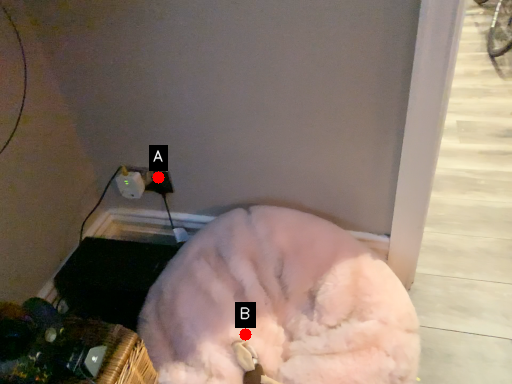
Question: Two points are circled on the image, labeled by A and B beside each circle. Which point appears closest to the camera in this image?

Choices:
 (A) A is closer
 (B) B is closer

Answer: (B)